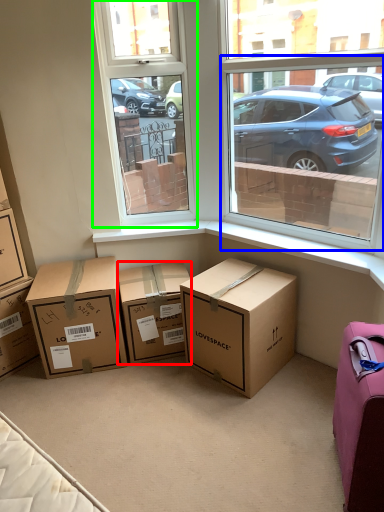
Question: Which object is positioned closest to box (highlighted by a red box)? Select from window screen (highlighted by a blue box) and window screen (highlighted by a green box).

Choices:
 (A) window screen
 (B) window screen

Answer: (B)